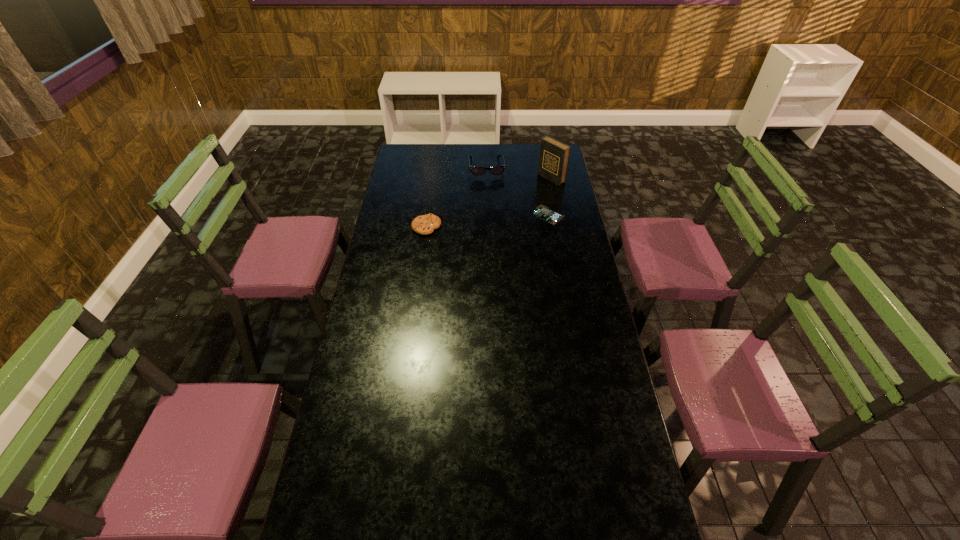
The height and width of the screenshot is (540, 960). In order to click on free region located on the front cover of the tallest object in this screenshot , I will do `click(493, 213)`.

This screenshot has height=540, width=960. What are the coordinates of `free location located on the lenses of the third object from right to left` in the screenshot? It's located at (490, 193).

This screenshot has width=960, height=540. I want to click on vacant space situated on the lenses of the third object from right to left, so click(x=493, y=219).

Locate an element on the screen. The width and height of the screenshot is (960, 540). vacant area located 0.130m on the lenses of the third object from right to left is located at coordinates (490, 194).

Locate an element on the screen. object located at the far edge is located at coordinates coord(496,170).

Locate an element on the screen. The height and width of the screenshot is (540, 960). object present at the left edge is located at coordinates (425, 224).

You are a GUI agent. You are given a task and a screenshot of the screen. Output one action in this format:
    pyautogui.click(x=<x>, y=<y>)
    Task: Click on the identity card located in the right edge section of the desktop
    The height and width of the screenshot is (540, 960).
    Given the screenshot: What is the action you would take?
    pyautogui.click(x=543, y=212)

Where is `diary that is at the right edge`? Image resolution: width=960 pixels, height=540 pixels. diary that is at the right edge is located at coordinates (554, 156).

The width and height of the screenshot is (960, 540). I want to click on vacant space at the far edge of the desktop, so click(x=452, y=153).

In the image, there is a desktop. Where is `free space at the near edge`? free space at the near edge is located at coordinates (377, 516).